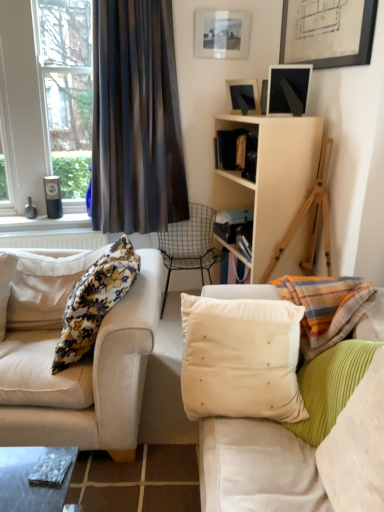
At what (x,y) coordinates should I click in order to perform the action: click on beige fabric couch at left. Please return your answer as a coordinate pair (x, y). This screenshot has width=384, height=512. Looking at the image, I should click on (84, 377).

Identify the location of matte black picture frame at upper center, the second picture frame positioned from the top. (243, 95).

The image size is (384, 512). Describe the element at coordinates (241, 358) in the screenshot. I see `beige velvet cushion at center, the 2th pillow positioned from the left` at that location.

Where is `matte black picture frame at upper right, which is the first picture frame from bottom to top`? The image size is (384, 512). matte black picture frame at upper right, which is the first picture frame from bottom to top is located at coordinates (288, 89).

Considering the sizes of objects linen cushion at right, marked as the first pillow in a right-to-left arrangement, and white plastic radiator at lower left in the image provided, who is wider, linen cushion at right, marked as the first pillow in a right-to-left arrangement, or white plastic radiator at lower left?

linen cushion at right, marked as the first pillow in a right-to-left arrangement, is wider.

Is linen cushion at right, marked as the first pillow in a right-to-left arrangement, inside or outside of white plastic radiator at lower left?

linen cushion at right, marked as the first pillow in a right-to-left arrangement, is spatially situated outside white plastic radiator at lower left.

How much distance is there between linen cushion at right, acting as the 3th pillow starting from the left, and white plastic radiator at lower left?

A distance of 1.98 meters exists between linen cushion at right, acting as the 3th pillow starting from the left, and white plastic radiator at lower left.

Is linen cushion at right, acting as the 3th pillow starting from the left, oriented towards white plastic radiator at lower left?

No, linen cushion at right, acting as the 3th pillow starting from the left, is not oriented towards white plastic radiator at lower left.

Considering the sizes of objects matte black speaker at left and linen cushion at right, marked as the first pillow in a right-to-left arrangement, in the image provided, who is wider, matte black speaker at left or linen cushion at right, marked as the first pillow in a right-to-left arrangement,?

Wider between the two is linen cushion at right, marked as the first pillow in a right-to-left arrangement.

Which of these two, matte black speaker at left or linen cushion at right, acting as the 3th pillow starting from the left, stands taller?

linen cushion at right, acting as the 3th pillow starting from the left.

Is matte black speaker at left bigger or smaller than linen cushion at right, marked as the first pillow in a right-to-left arrangement?

In the image, matte black speaker at left appears to be smaller than linen cushion at right, marked as the first pillow in a right-to-left arrangement.

Is point (37, 222) closer or farther from the camera than point (337, 382)?

Point (37, 222).

Considering the sizes of objects wire mesh chair at center and matte black speaker at left in the image provided, who is taller, wire mesh chair at center or matte black speaker at left?

Standing taller between the two is wire mesh chair at center.

Consider the image. Is matte black speaker at left a part of wire mesh chair at center?

That's incorrect, matte black speaker at left is not inside wire mesh chair at center.

Considering the relative sizes of wire mesh chair at center and matte black speaker at left in the image provided, is wire mesh chair at center wider than matte black speaker at left?

Yes, wire mesh chair at center is wider than matte black speaker at left.

Which object is further away from the camera taking this photo, wire mesh chair at center or matte black speaker at left?

matte black speaker at left.

Which point is more distant from viewer, (306, 98) or (28, 226)?

The point (28, 226) is more distant.

Between matte black picture frame at upper right, which is the first picture frame from bottom to top, and matte black speaker at left, which one has more height?

matte black picture frame at upper right, which is the first picture frame from bottom to top, is taller.

Is matte black speaker at left at the back of matte black picture frame at upper right, marked as the 3th picture frame in a top-to-bottom arrangement?

No.

Considering the sizes of matte black picture frame at upper right, marked as the 3th picture frame in a top-to-bottom arrangement, and matte black speaker at left in the image, is matte black picture frame at upper right, marked as the 3th picture frame in a top-to-bottom arrangement, bigger or smaller than matte black speaker at left?

A: Clearly, matte black picture frame at upper right, marked as the 3th picture frame in a top-to-bottom arrangement, is larger in size than matte black speaker at left.

Is linen cushion at right, acting as the 3th pillow starting from the left, looking in the opposite direction of matte black picture frame at upper right, which is the first picture frame from bottom to top?

That's not correct — linen cushion at right, acting as the 3th pillow starting from the left, is not looking away from matte black picture frame at upper right, which is the first picture frame from bottom to top.

Consider the image. From the image's perspective, between linen cushion at right, marked as the first pillow in a right-to-left arrangement, and matte black picture frame at upper right, which is the first picture frame from bottom to top, which one is located above?

matte black picture frame at upper right, which is the first picture frame from bottom to top.

Does linen cushion at right, marked as the first pillow in a right-to-left arrangement, lie behind matte black picture frame at upper right, which is the first picture frame from bottom to top?

No, the depth of linen cushion at right, marked as the first pillow in a right-to-left arrangement, is less than that of matte black picture frame at upper right, which is the first picture frame from bottom to top.

There is a linen cushion at right, acting as the 3th pillow starting from the left. Identify the location of the 1st picture frame above it (from the image's perspective). (288, 89).

Is point (58, 223) in front of point (20, 359)?

No, (58, 223) is further to viewer.

Is matte black speaker at left located outside beige fabric couch at left?

Indeed, matte black speaker at left is completely outside beige fabric couch at left.

I want to click on window sill that appears above the beige fabric couch at left (from the image's perspective), so click(44, 223).

Is matte black speaker at left positioned far away from beige fabric couch at left?

Yes.

Considering the relative sizes of wire mesh chair at center and beige fabric couch at left in the image provided, is wire mesh chair at center taller than beige fabric couch at left?

In fact, wire mesh chair at center may be shorter than beige fabric couch at left.

This screenshot has width=384, height=512. I want to click on chair that appears above the beige fabric couch at left (from the image's perspective), so click(x=190, y=244).

Is point (181, 228) behind point (39, 368)?

Yes, it is.

Based on the photo, is wire mesh chair at center turned away from beige fabric couch at left?

wire mesh chair at center does not have its back to beige fabric couch at left.

The image size is (384, 512). What are the coordinates of `pillow below the white plastic radiator at lower left (from a real-world perspective)` in the screenshot? It's located at (330, 386).

At what (x,y) coordinates should I click in order to perform the action: click on the 3rd pillow below the matte black speaker at left (from the image's perspective). Please return your answer as a coordinate pair (x, y). Looking at the image, I should click on (330, 386).

Which object lies further to the anchor point dark sheer curtain at left, white plastic radiator at lower left or matte black picture frame at upper right, marked as the 3th picture frame in a top-to-bottom arrangement?

matte black picture frame at upper right, marked as the 3th picture frame in a top-to-bottom arrangement, lies further to dark sheer curtain at left than the other object.

Estimate the real-world distances between objects in this image. Which object is closer to matte black picture frame at upper right, which is the first picture frame from bottom to top, beige fabric couch at left or matte black picture frame at upper center, the second picture frame positioned from the top?

Among the two, matte black picture frame at upper center, the second picture frame positioned from the top, is located nearer to matte black picture frame at upper right, which is the first picture frame from bottom to top.

Estimate the real-world distances between objects in this image. Which object is further from beige velvet cushion at center, the 2th pillow positioned from the left, floral fabric pillow at left, positioned as the 3th pillow in right-to-left order, or beige fabric couch at left?

floral fabric pillow at left, positioned as the 3th pillow in right-to-left order, lies further to beige velvet cushion at center, the 2th pillow positioned from the left, than the other object.

From the picture: When comparing their distances from matte black picture frame at upper right, which is the first picture frame from bottom to top, does dark sheer curtain at left or white plastic radiator at lower left seem closer?

dark sheer curtain at left is positioned closer to the anchor matte black picture frame at upper right, which is the first picture frame from bottom to top.

Considering their positions, is matte black picture frame at upper right, which is the first picture frame from bottom to top, positioned closer to beige fabric couch at left than white plastic radiator at lower left?

The object closer to beige fabric couch at left is white plastic radiator at lower left.

From the picture: Estimate the real-world distances between objects in this image. Which object is closer to matte glass picture frame at upper center, the 1th picture frame in the top-to-bottom sequence, linen cushion at right, acting as the 3th pillow starting from the left, or matte black speaker at left?

matte black speaker at left is positioned closer to the anchor matte glass picture frame at upper center, the 1th picture frame in the top-to-bottom sequence.

From the picture: When comparing their distances from dark sheer curtain at left, does matte glass picture frame at upper center, the 1th picture frame in the top-to-bottom sequence, or beige fabric couch at left seem closer?

The object closer to dark sheer curtain at left is matte glass picture frame at upper center, the 1th picture frame in the top-to-bottom sequence.

Looking at the image, which one is located closer to matte black speaker at left, linen cushion at right, marked as the first pillow in a right-to-left arrangement, or matte black picture frame at upper center, the second picture frame positioned from the top?

Based on the image, matte black picture frame at upper center, the second picture frame positioned from the top, appears to be nearer to matte black speaker at left.

Locate an element on the screen. studio couch between matte black speaker at left and matte black picture frame at upper right, which is the first picture frame from bottom to top is located at coordinates (84, 377).

The image size is (384, 512). I want to click on curtain that lies between matte glass picture frame at upper center, arranged as the third picture frame when ordered from the bottom, and beige fabric couch at left from top to bottom, so click(136, 119).

Image resolution: width=384 pixels, height=512 pixels. In order to click on curtain that lies between matte glass picture frame at upper center, arranged as the third picture frame when ordered from the bottom, and beige velvet cushion at center, the second pillow in the right-to-left sequence, from top to bottom in this screenshot , I will do `click(136, 119)`.

Find the location of a particular element. curtain between matte black picture frame at upper right, which is the first picture frame from bottom to top, and beige fabric couch at left in the up-down direction is located at coordinates (136, 119).